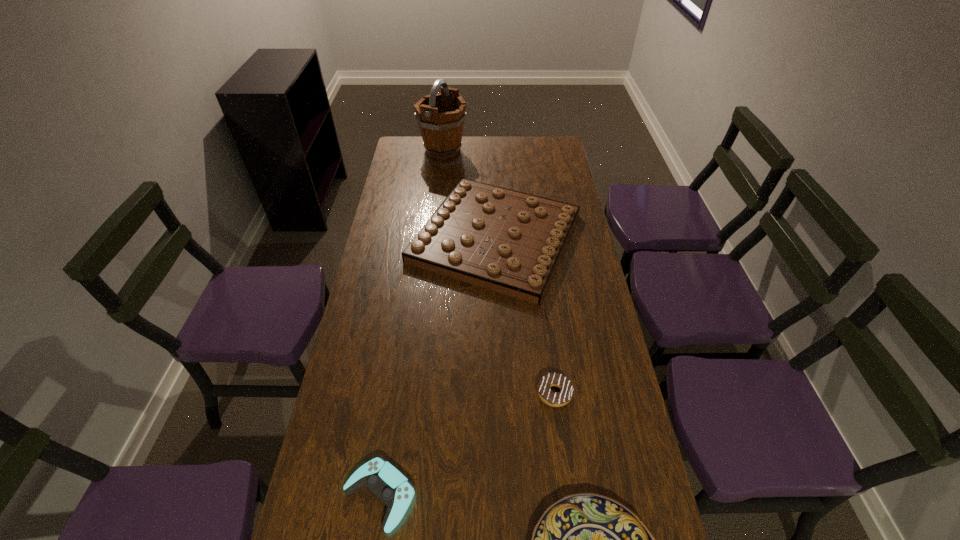
Where is `bucket`? The height and width of the screenshot is (540, 960). bucket is located at coordinates (441, 116).

You are a GUI agent. You are given a task and a screenshot of the screen. Output one action in this format:
    pyautogui.click(x=<x>, y=<y>)
    Task: Click on the tallest object
    The height and width of the screenshot is (540, 960).
    Given the screenshot: What is the action you would take?
    pyautogui.click(x=441, y=116)

Where is `the second tallest object`? The width and height of the screenshot is (960, 540). the second tallest object is located at coordinates coord(510,242).

Image resolution: width=960 pixels, height=540 pixels. What are the coordinates of `the second farthest object` in the screenshot? It's located at (510, 242).

This screenshot has height=540, width=960. Identify the location of control. (390, 486).

Locate an element on the screen. The height and width of the screenshot is (540, 960). the second shortest object is located at coordinates (559, 399).

The height and width of the screenshot is (540, 960). I want to click on the third nearest object, so click(x=559, y=399).

Where is `blank space located 0.360m on the front of the tallest object`? blank space located 0.360m on the front of the tallest object is located at coordinates [436, 212].

Find the location of a particular element. vacant space located on the front of the fourth shortest object is located at coordinates (503, 422).

This screenshot has width=960, height=540. I want to click on blank area located on the back of the control, so click(x=394, y=401).